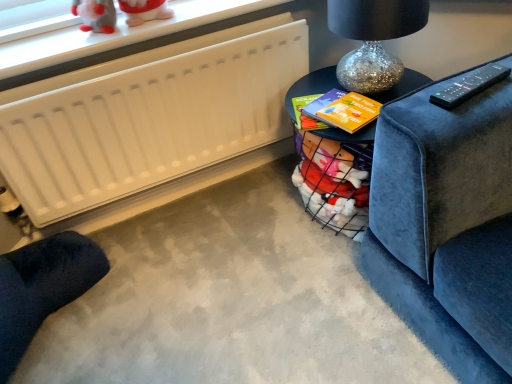
Find the location of `empty space that is ontop of white matte radiator at upper left (from a real-world perspective)`. empty space that is ontop of white matte radiator at upper left (from a real-world perspective) is located at coordinates (118, 57).